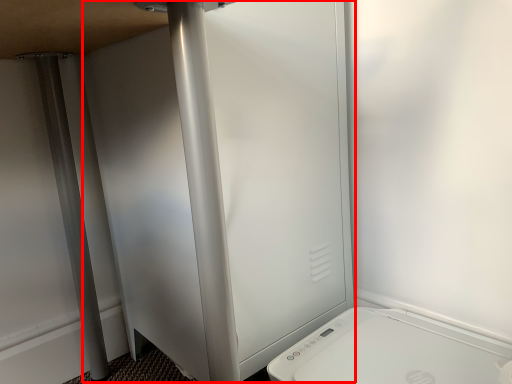
Question: In this image, where is screen door (annotated by the red box) located relative to home appliance?

Choices:
 (A) left
 (B) right

Answer: (A)